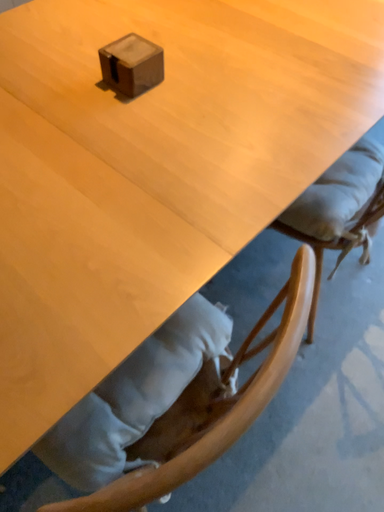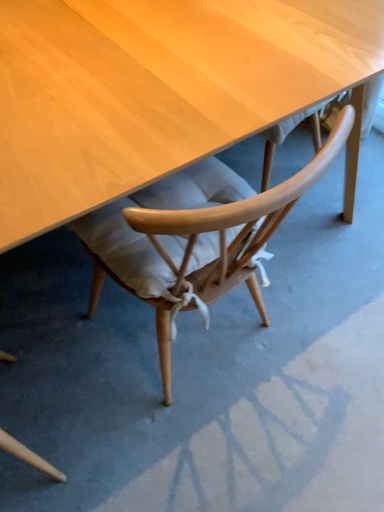
Question: How did the camera likely rotate when shooting the video?

Choices:
 (A) rotated left
 (B) rotated right

Answer: (A)